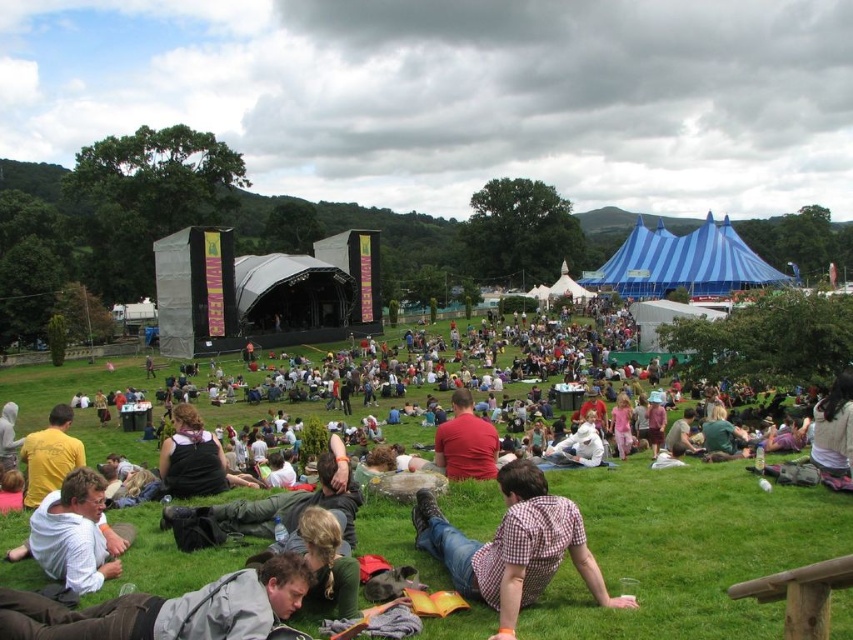
Which of these two, checkered fabric shirt at center or white cotton shirt at lower left, stands taller?

checkered fabric shirt at center is taller.

Is point (508, 621) more distant than point (44, 563)?

No, it is not.

Is point (589, 586) more distant than point (82, 513)?

No.

The width and height of the screenshot is (853, 640). I want to click on checkered fabric shirt at center, so click(x=514, y=547).

Which is more to the right, gray fabric jacket at lower left or red matte shirt at center?

Positioned to the right is red matte shirt at center.

The image size is (853, 640). What are the coordinates of `gray fabric jacket at lower left` in the screenshot? It's located at (167, 609).

In the scene shown: Who is lower down, checkered fabric shirt at center or red matte shirt at center?

checkered fabric shirt at center is lower down.

Is checkered fabric shirt at center closer to camera compared to red matte shirt at center?

Yes, checkered fabric shirt at center is in front of red matte shirt at center.

Is point (573, 536) positioned in front of point (465, 419)?

Yes, point (573, 536) is in front of point (465, 419).

Image resolution: width=853 pixels, height=640 pixels. Find the location of `checkered fabric shirt at center`. checkered fabric shirt at center is located at coordinates (514, 547).